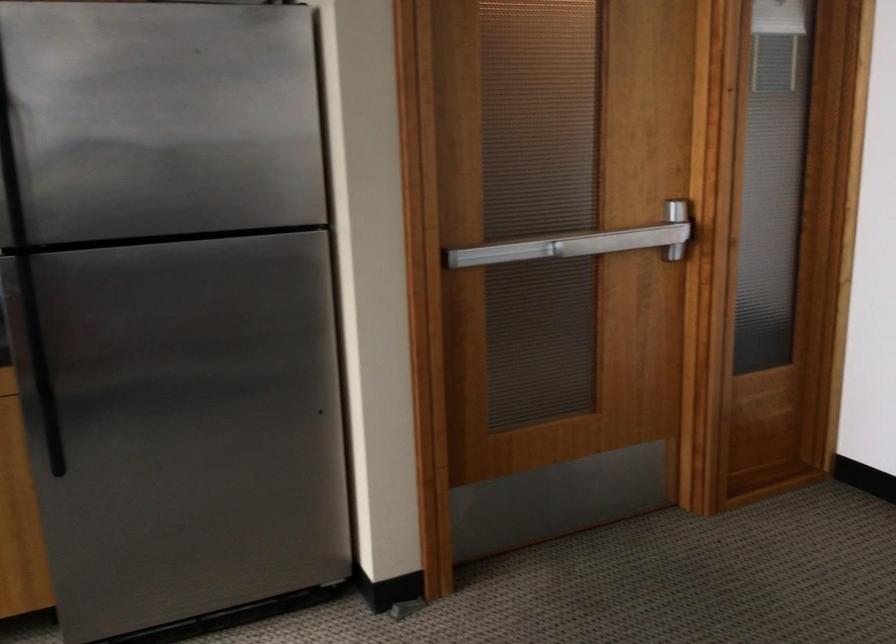
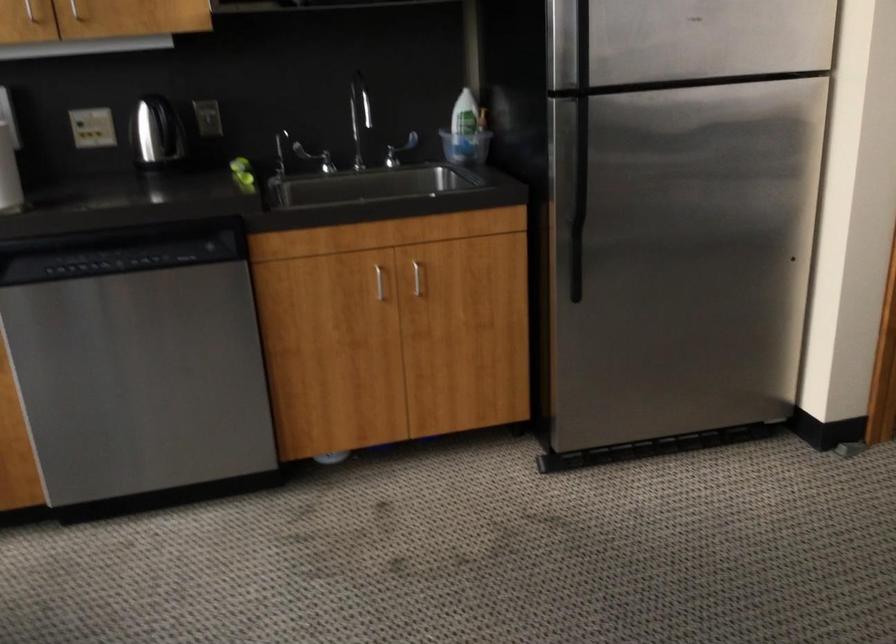
Question: The first image is from the beginning of the video and the second image is from the end. How did the camera likely rotate when shooting the video?

Choices:
 (A) Left
 (B) Right
 (C) Up
 (D) Down

Answer: (A)